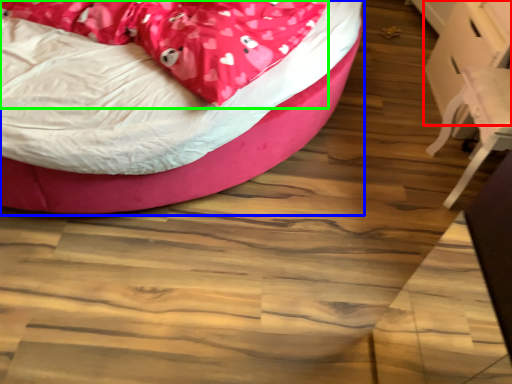
Question: Estimate the real-world distances between objects in this image. Which object is closer to table (highlighted by a red box), bed (highlighted by a blue box) or blanket (highlighted by a green box)?

Choices:
 (A) bed
 (B) blanket

Answer: (A)